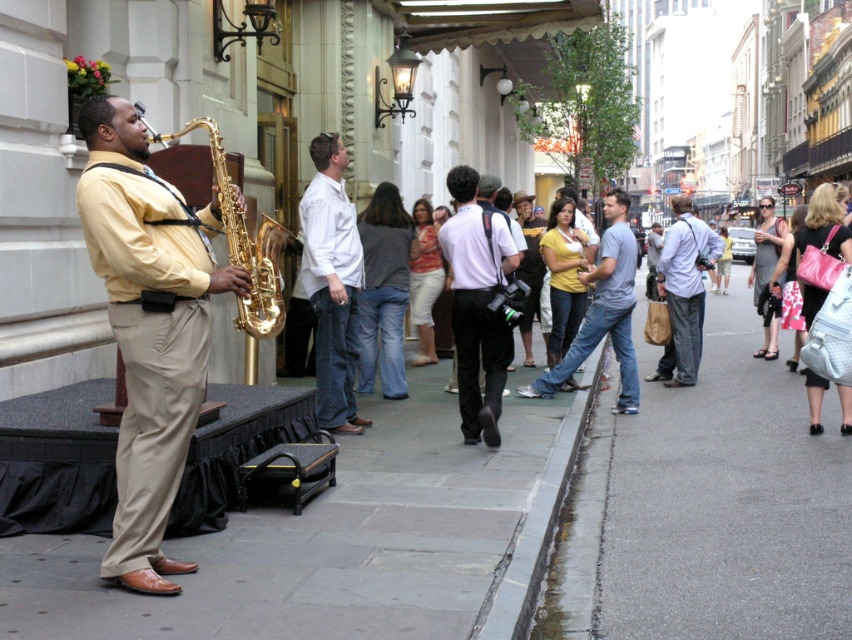
Question: Is white matte shirt at center below concrete at lower right?

Choices:
 (A) no
 (B) yes

Answer: (A)

Question: Which of these objects is positioned closest to the light blue jeans at center?

Choices:
 (A) gold shiny saxophone at left
 (B) white cotton shirt at center
 (C) denim jeans at center
 (D) gray concrete sidewalk at lower left

Answer: (C)

Question: Which of these objects is positioned farthest from the matte gold saxophone at left?

Choices:
 (A) denim jeans at center
 (B) white matte shirt at center
 (C) white cotton shirt at center

Answer: (A)

Question: Does white cotton shirt at center have a greater width compared to gold shiny saxophone at left?

Choices:
 (A) no
 (B) yes

Answer: (A)

Question: Is white cotton shirt at center smaller than concrete at lower right?

Choices:
 (A) yes
 (B) no

Answer: (A)

Question: Among these objects, which one is nearest to the camera?

Choices:
 (A) concrete at lower right
 (B) white matte shirt at center
 (C) light blue jeans at center

Answer: (A)